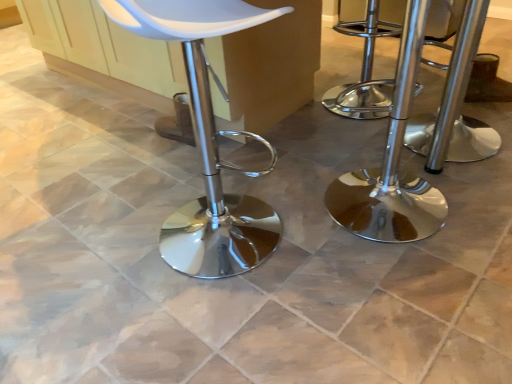
Image resolution: width=512 pixels, height=384 pixels. What are the coordinates of `free area in between chrome/metallic stool at right, acting as the first stool starting from the left, and polished chrome stool at center, the first stool when ordered from right to left` in the screenshot? It's located at (420, 169).